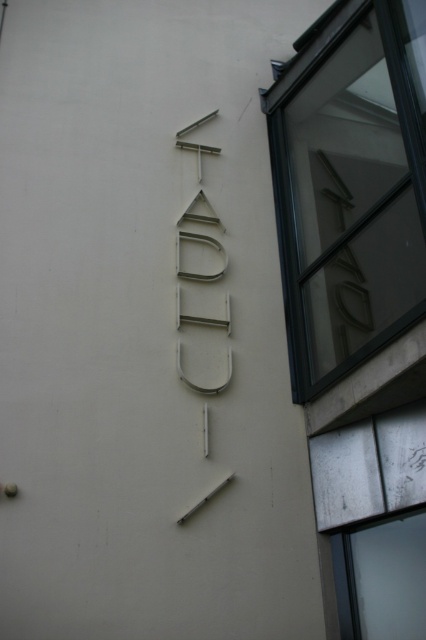
Question: Which object appears closest to the camera in this image?

Choices:
 (A) metallic silver sign at center
 (B) black glass window at upper right

Answer: (B)

Question: Which point is farther to the camera?

Choices:
 (A) metallic silver sign at center
 (B) black glass window at upper right

Answer: (A)

Question: Which of the following is the farthest from the observer?

Choices:
 (A) (287, 93)
 (B) (221, 268)

Answer: (A)

Question: Can you confirm if black glass window at upper right is positioned below metallic silver sign at center?

Choices:
 (A) no
 (B) yes

Answer: (A)

Question: Does black glass window at upper right have a smaller size compared to metallic silver sign at center?

Choices:
 (A) yes
 (B) no

Answer: (B)

Question: Does black glass window at upper right have a greater width compared to metallic silver sign at center?

Choices:
 (A) yes
 (B) no

Answer: (A)